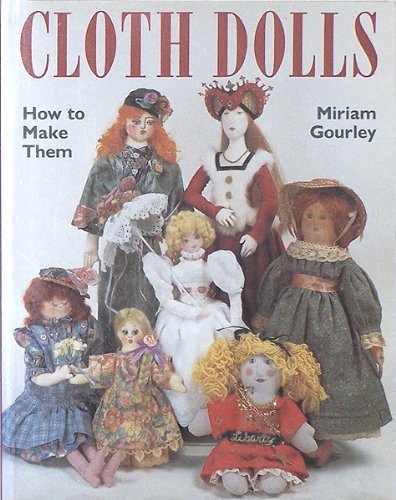
The image size is (396, 500). What are the coordinates of `cloth dolls` in the screenshot? It's located at pos(40,44).